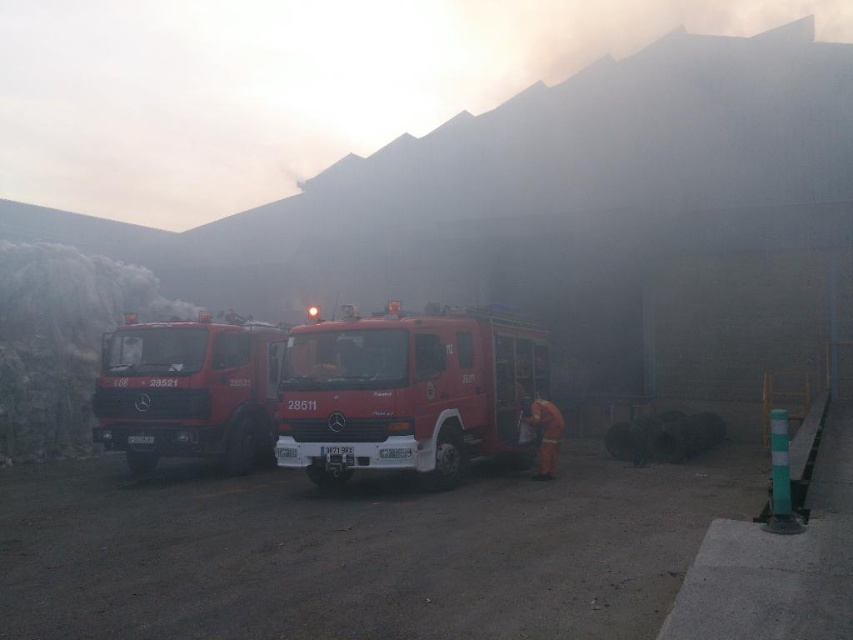
Between point (492, 358) and point (259, 380), which one is positioned behind?

Positioned behind is point (259, 380).

Does shiny red fire truck at center have a greater height compared to matte red fire truck at center?

No, shiny red fire truck at center is not taller than matte red fire truck at center.

The image size is (853, 640). What are the coordinates of `shiny red fire truck at center` in the screenshot? It's located at (405, 394).

Does shiny red fire truck at center have a lesser width compared to orange fabric fireman at center?

No, shiny red fire truck at center is not thinner than orange fabric fireman at center.

From the picture: Can you confirm if shiny red fire truck at center is positioned below orange fabric fireman at center?

No, shiny red fire truck at center is not below orange fabric fireman at center.

Image resolution: width=853 pixels, height=640 pixels. What do you see at coordinates (405, 394) in the screenshot? I see `shiny red fire truck at center` at bounding box center [405, 394].

In order to click on shiny red fire truck at center in this screenshot , I will do `click(405, 394)`.

Is matte red fire truck at center smaller than orange fabric fireman at center?

Incorrect, matte red fire truck at center is not smaller in size than orange fabric fireman at center.

Is matte red fire truck at center wider than orange fabric fireman at center?

Correct, the width of matte red fire truck at center exceeds that of orange fabric fireman at center.

Identify the location of matte red fire truck at center. (189, 392).